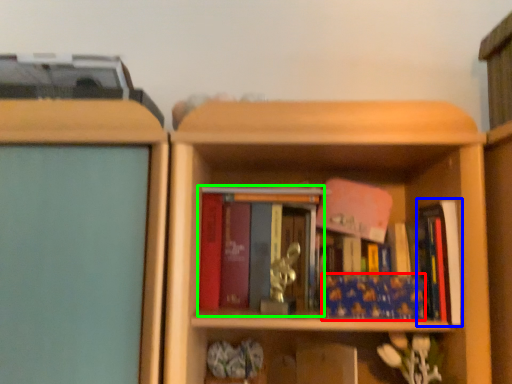
Question: Based on their relative distances, which object is farther from book (highlighted by a red box)? Choose from book (highlighted by a blue box) and book (highlighted by a green box).

Choices:
 (A) book
 (B) book

Answer: (B)